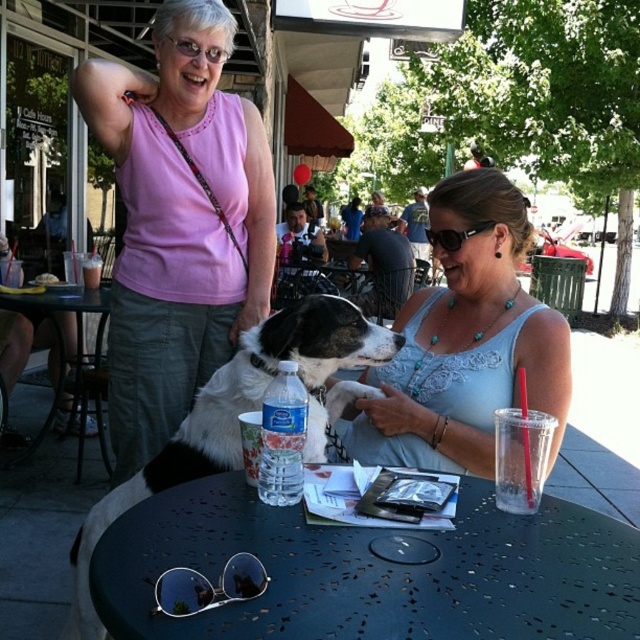
You are a server at the cafe and need to place a 16 inch wide tray on the table. Can you fit it between the metallic black table at center and the pearl necklace at center?

The metallic black table at center and pearl necklace at center are 17.48 inches apart from each other. Since the tray is 16 inches wide, it can fit between them.

You are a photographer wanting to capture a closeup of the black and white fur dog at center and the clear plastic water bottle at center. Which object should you zoom in on first if you want to focus on the larger subject?

The black and white fur dog at center is larger than the clear plastic water bottle at center, so you should zoom in on the black and white fur dog at center first to focus on the larger subject.